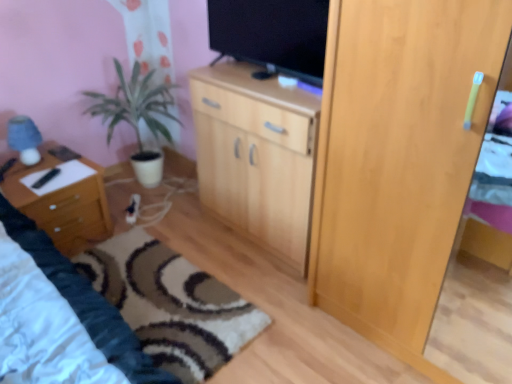
This screenshot has height=384, width=512. I want to click on free space between wooden cabinet at center and carpet with swirl pattern at lower center, so click(222, 252).